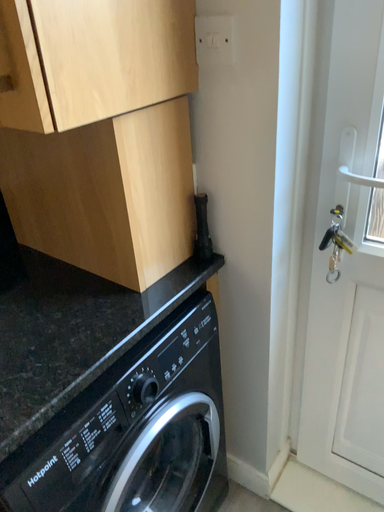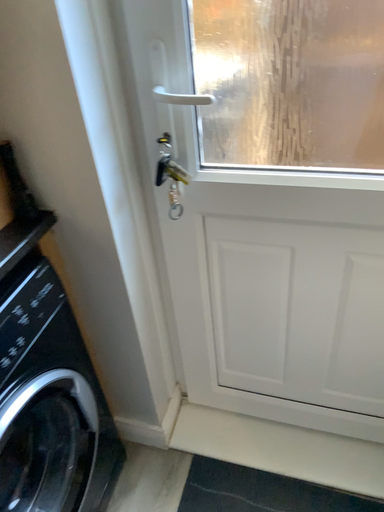
Question: How did the camera likely rotate when shooting the video?

Choices:
 (A) rotated right
 (B) rotated left

Answer: (A)